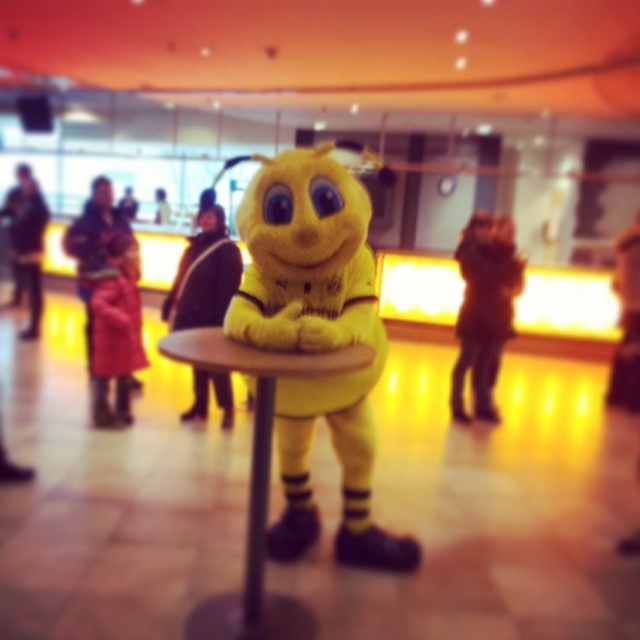
Does velvet red coat at left appear on the left side of black plastic pole at center?

Correct, you'll find velvet red coat at left to the left of black plastic pole at center.

In the scene shown: Is velvet red coat at left further to camera compared to black plastic pole at center?

That is True.

Who is more forward, (116, 355) or (262, 388)?

Point (262, 388) is in front.

Find the location of a particular element. The height and width of the screenshot is (640, 640). velvet red coat at left is located at coordinates (115, 330).

Which is above, black plastic pole at center or red wool coat at left?

red wool coat at left is higher up.

Between black plastic pole at center and red wool coat at left, which one appears on the right side from the viewer's perspective?

Positioned to the right is black plastic pole at center.

Does point (260, 384) come in front of point (12, 204)?

Yes, point (260, 384) is in front of point (12, 204).

Locate an element on the screen. black plastic pole at center is located at coordinates (257, 500).

Between matte yellow costume at center and red wool coat at left, which one appears on the left side from the viewer's perspective?

Positioned to the left is red wool coat at left.

Which is in front, point (182, 323) or point (22, 272)?

Point (182, 323) is in front.

Is point (218, 234) farther from camera compared to point (36, 262)?

No.

This screenshot has height=640, width=640. Identify the location of matte yellow costume at center. (204, 275).